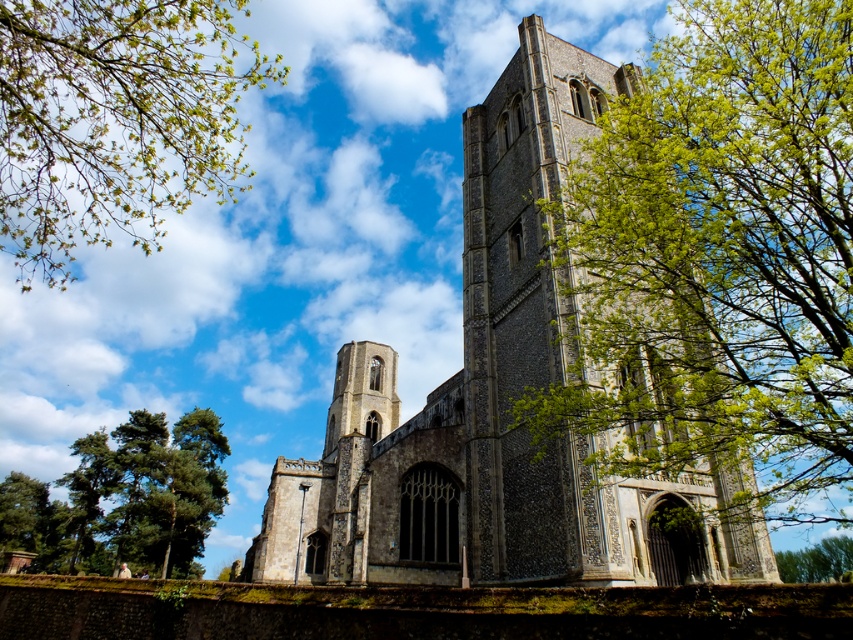
You are standing in front of the stone church at center and looking towards the green leafy tree at right. Which object is higher in the scene?

The green leafy tree at right is higher than the stone church at center.

You are standing at the base of the historic stone church and want to take a photo of the green leafy tree at right. If your camera has a maximum zoom range of 100 feet, will you be able to capture the entire tree in the photo without moving closer?

The green leafy tree at right is 118.36 feet away from the viewer. Since the camera can only zoom up to 100 feet, you will not be able to capture the entire tree without moving closer.

You are standing in front of the historic stone church and looking at the green leafy branches at upper left. What are their coordinates?

The green leafy branches at upper left are located at point (115,120).